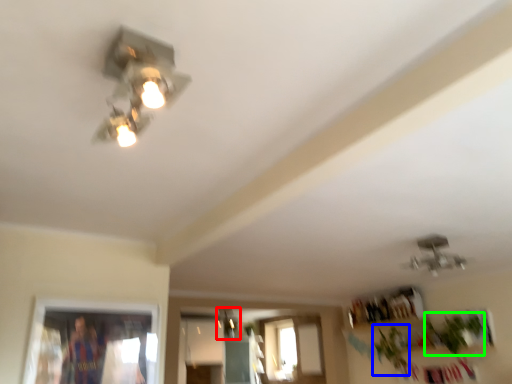
Question: Which object is the closest to the lamp (highlighted by a red box)? Choose among these: plant (highlighted by a blue box) or plant (highlighted by a green box).

Choices:
 (A) plant
 (B) plant

Answer: (A)